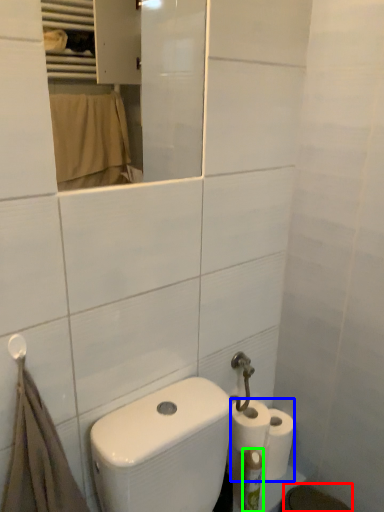
Question: Which is nearer to the bidet (highlighted by a red box)? toilet paper (highlighted by a blue box) or toiletry (highlighted by a green box).

Choices:
 (A) toilet paper
 (B) toiletry

Answer: (B)